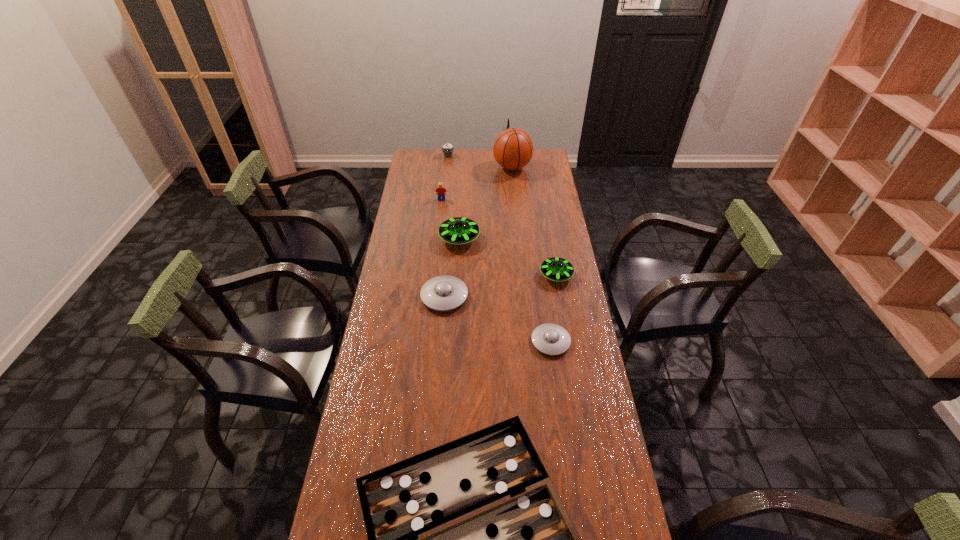
Find the location of a particular element. Image resolution: width=960 pixels, height=540 pixels. the tallest object is located at coordinates (513, 148).

I want to click on cupcake, so click(x=447, y=149).

The height and width of the screenshot is (540, 960). In order to click on the third farthest object in this screenshot , I will do `click(442, 192)`.

Where is `the farthest saucer`? The height and width of the screenshot is (540, 960). the farthest saucer is located at coordinates (459, 230).

Where is `the bigger green saucer`? the bigger green saucer is located at coordinates (459, 230).

In order to click on the right green saucer in this screenshot , I will do `click(557, 269)`.

The width and height of the screenshot is (960, 540). What are the coordinates of `the nearer green saucer` in the screenshot? It's located at (557, 269).

Locate an element on the screen. the left gray saucer is located at coordinates (442, 293).

Locate an element on the screen. This screenshot has width=960, height=540. the bigger gray saucer is located at coordinates (442, 293).

Image resolution: width=960 pixels, height=540 pixels. In order to click on the nearest saucer in this screenshot , I will do `click(551, 339)`.